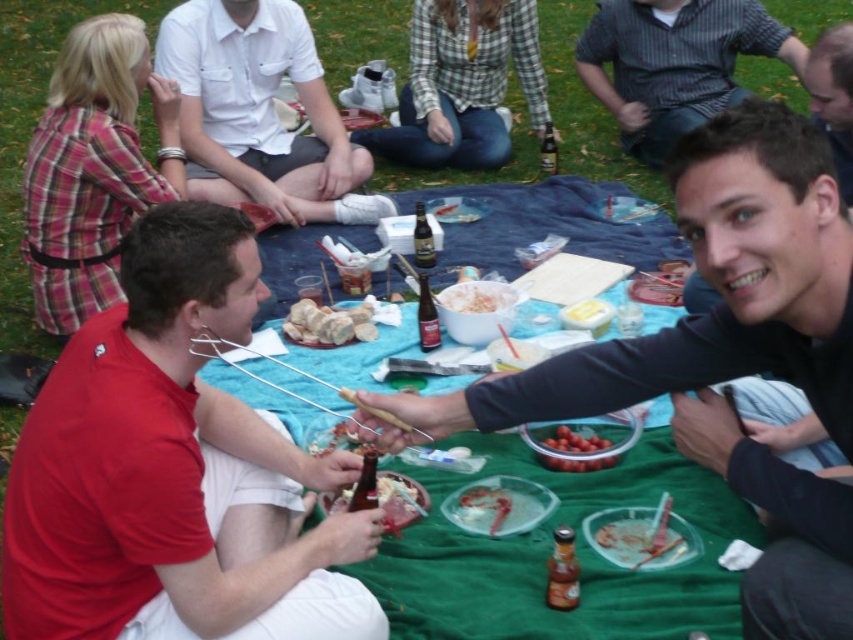
You are a photographer trying to capture a clear shot of the meat at center without any obstruction. You notice the white cotton shirt at upper center is in the way. Can you adjust your position to take the photo without moving any objects?

The meat at center is behind the white cotton shirt at upper center, so you can move your camera position lower to capture the meat at center without the obstruction of the white cotton shirt at upper center.

Based on the photo, looking at the picnic scene, where is the white cotton shirt at upper center in relation to the smooth black hair at upper right?

The white cotton shirt at upper center is to the left of smooth black hair at upper right.

Consider the image. You are a photographer at the picnic and want to capture both the white cotton shirt at upper center and the smooth black hair at upper right in a single frame. Which object should you focus on first to ensure both are in the frame?

You should focus on the white cotton shirt at upper center first because it has a larger size compared to the smooth black hair at upper right, making it easier to frame both objects in the shot.